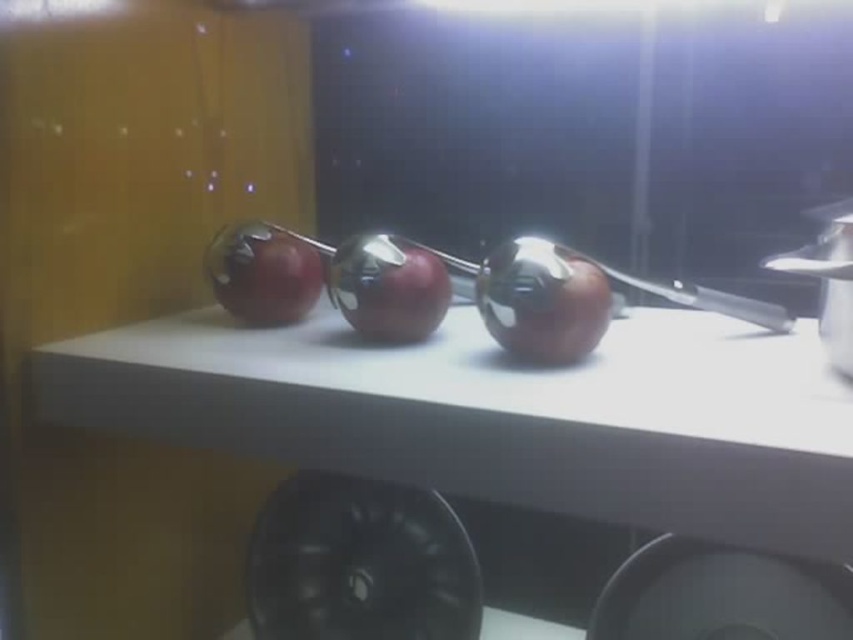
Question: Based on their relative distances, which object is farther from the shiny red apple at center?

Choices:
 (A) glossy red apple at center
 (B) white matte counter top at center
 (C) shiny metallic apple at center

Answer: (B)

Question: Among these points, which one is nearest to the camera?

Choices:
 (A) (271, 266)
 (B) (575, 285)

Answer: (B)

Question: From the image, what is the correct spatial relationship of white matte counter top at center in relation to glossy red apple at center?

Choices:
 (A) left
 (B) right

Answer: (B)

Question: Can you confirm if white matte counter top at center is positioned above glossy red apple at center?

Choices:
 (A) no
 (B) yes

Answer: (A)

Question: Which object is farther from the camera taking this photo?

Choices:
 (A) white matte counter top at center
 (B) shiny red apple at center

Answer: (B)

Question: From the image, what is the correct spatial relationship of white matte counter top at center in relation to shiny metallic apple at center?

Choices:
 (A) below
 (B) above

Answer: (A)